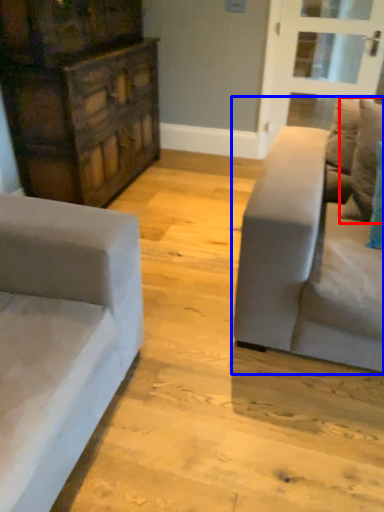
Question: Among these objects, which one is farthest to the camera, pillow (highlighted by a red box) or studio couch (highlighted by a blue box)?

Choices:
 (A) pillow
 (B) studio couch

Answer: (A)